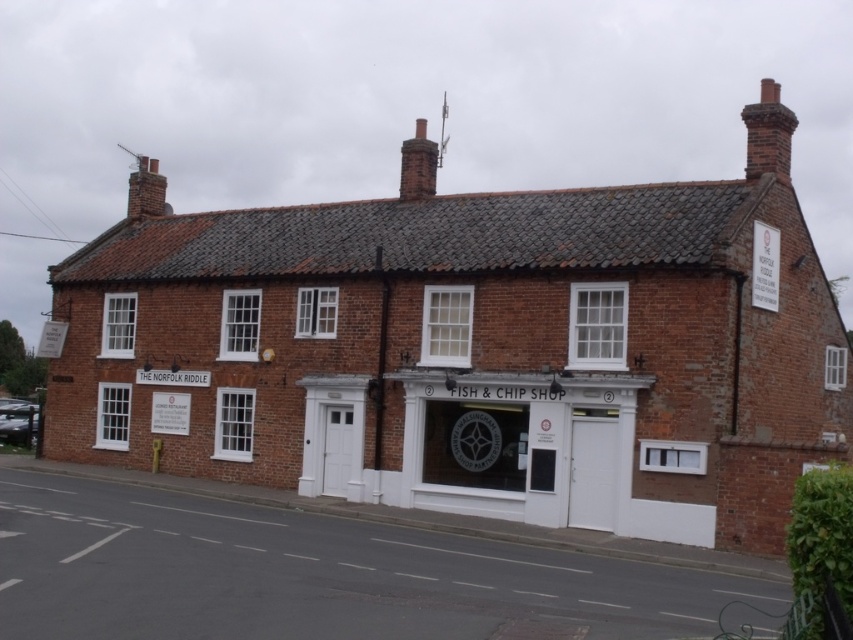
You are a delivery person trying to navigate between the two chimneys, the red brick chimney at upper right and the brick chimney at upper left. Which chimney should you avoid if you need to pass under the lower one?

You should avoid the brick chimney at upper left because the red brick chimney at upper right is taller, so the brick chimney at upper left is shorter and lower, making it the one you can pass under.

You are a delivery person trying to identify the correct chimney to place a package on top of. The package requires a chimney that is larger in size. Which chimney should you choose between the brick chimney at upper center and the brick chimney at upper left?

The brick chimney at upper left is larger than the brick chimney at upper center, so you should choose the brick chimney at upper left to place the package on top.